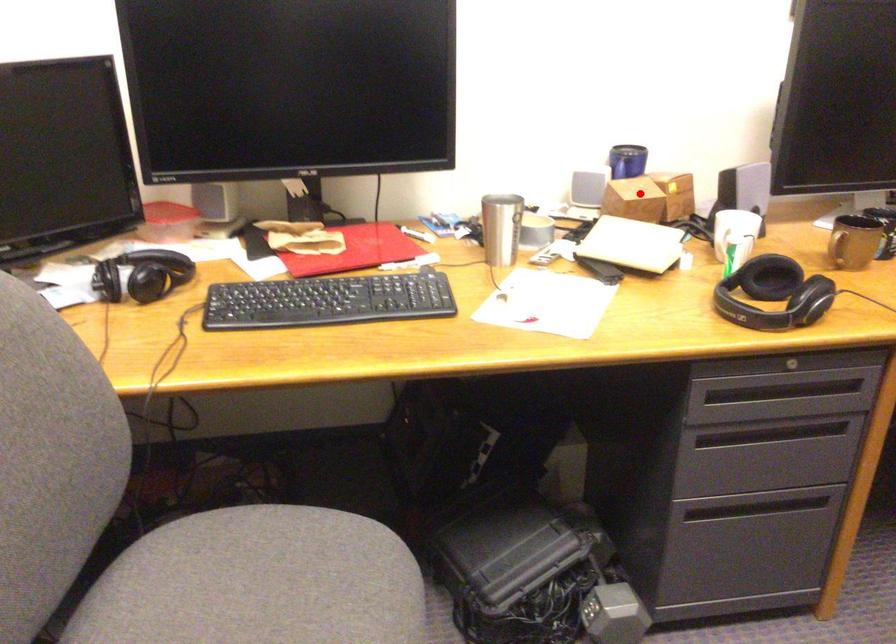
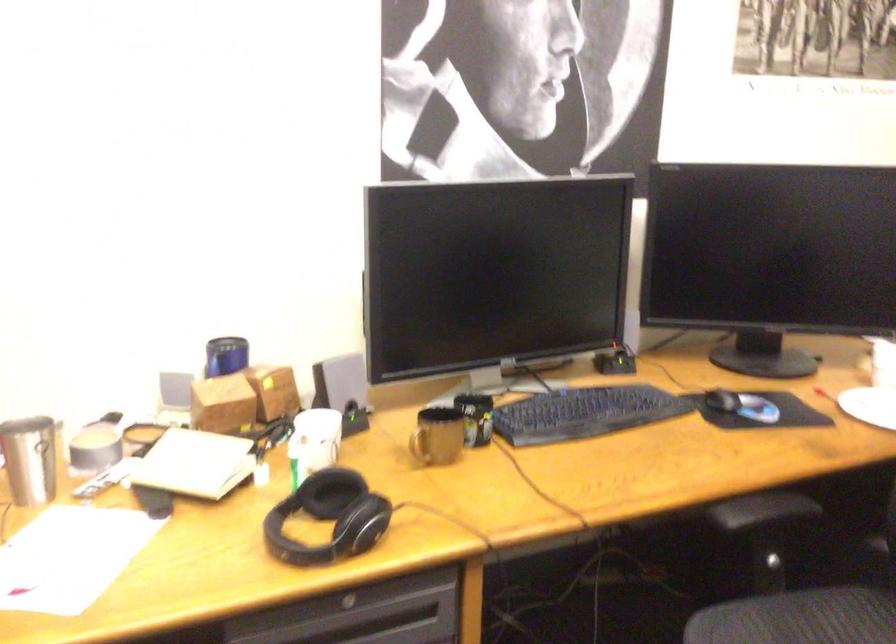
Question: I am providing you with two images of the same scene from different viewpoints. Given a red point in image1, look at the same physical point in image2. Is it:

Choices:
 (A) Closer to the viewpoint
 (B) Farther from the viewpoint

Answer: (A)